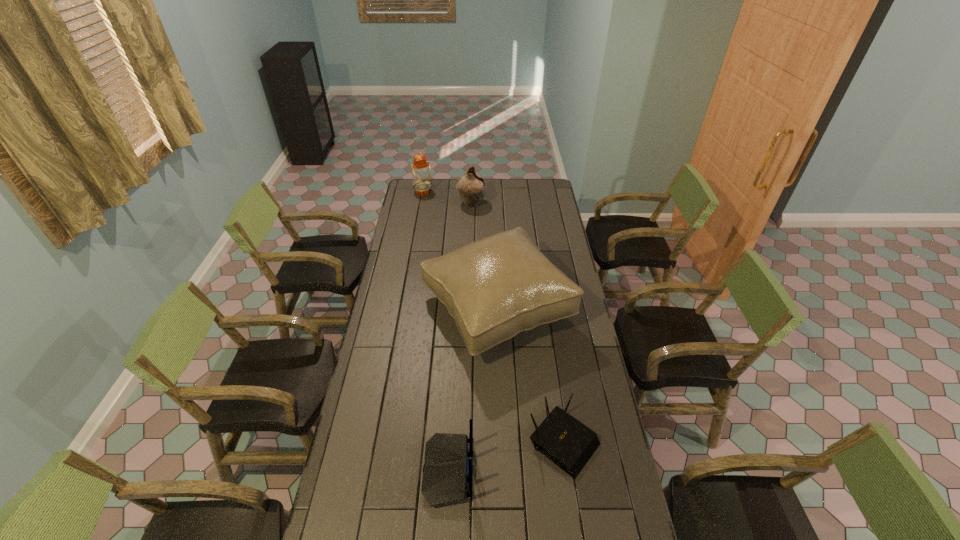
This screenshot has height=540, width=960. What are the coordinates of `the leftmost object` in the screenshot? It's located at (421, 171).

Identify the location of the third farthest object. coord(496,287).

I want to click on pottery, so click(x=471, y=188).

Identify the location of the taller router. (445, 479).

I want to click on the left router, so click(x=445, y=479).

Locate an element on the screen. This screenshot has width=960, height=540. the shortest object is located at coordinates (568, 443).

Image resolution: width=960 pixels, height=540 pixels. Identify the location of the shorter router. (568, 443).

You are a GUI agent. You are given a task and a screenshot of the screen. Output one action in this format:
    pyautogui.click(x=<x>, y=<y>)
    Task: Click on the free region located 0.080m on the front of the oil lamp
    
    Given the screenshot: What is the action you would take?
    pyautogui.click(x=420, y=204)

Find the location of `vacant space located 0.150m on the front of the third nearest object`. vacant space located 0.150m on the front of the third nearest object is located at coordinates (500, 407).

I want to click on blank space located 0.140m from the spout of the pottery, so click(x=510, y=204).